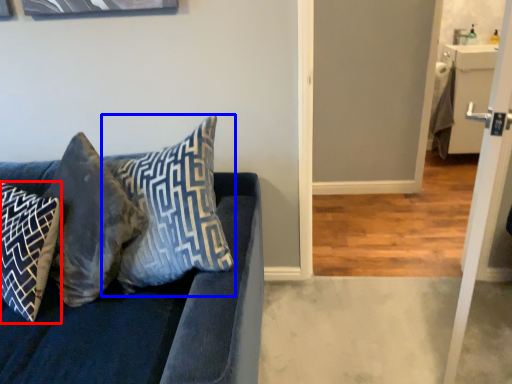
Question: Which object is closer to the camera taking this photo, pillow (highlighted by a red box) or pillow (highlighted by a blue box)?

Choices:
 (A) pillow
 (B) pillow

Answer: (B)